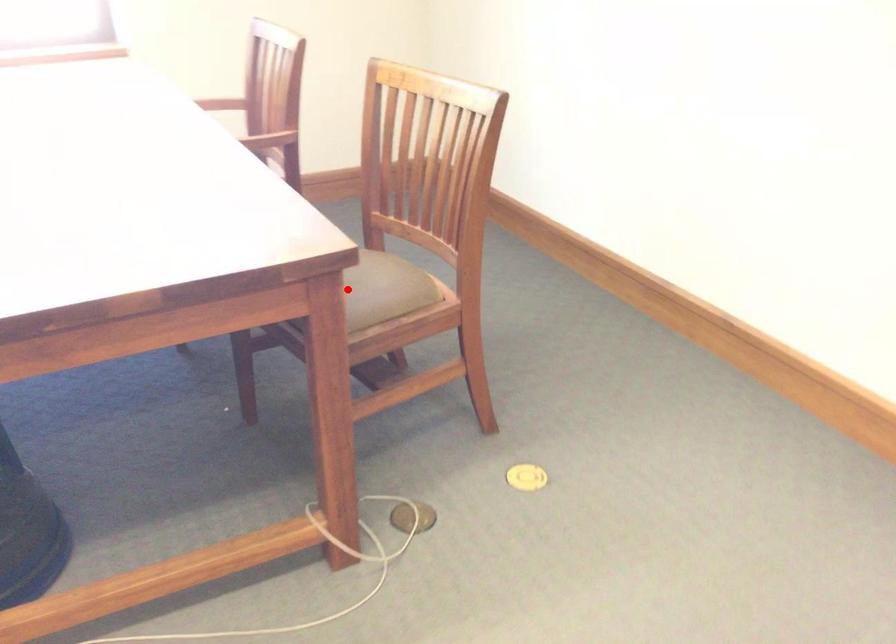
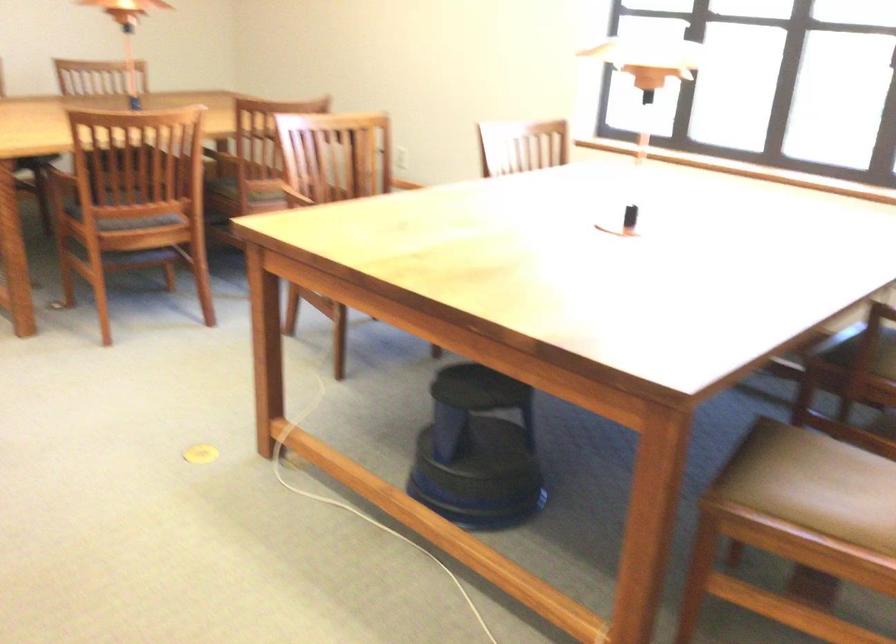
Where in the second image is the point corresponding to the highlighted location from the first image?

(824, 478)